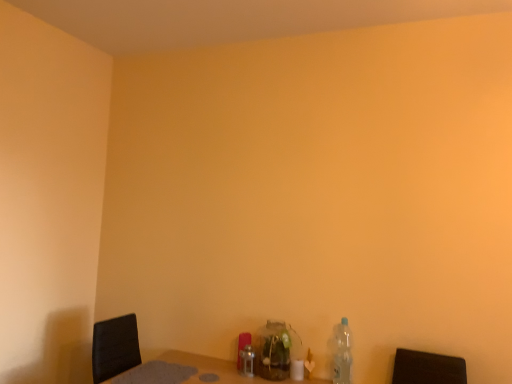
Question: From the image's perspective, is clear plastic bottle at lower right, the first bottle viewed from the right, over brushed metal bottle at center, arranged as the first bottle when viewed from the left?

Choices:
 (A) no
 (B) yes

Answer: (B)

Question: Is clear plastic bottle at lower right, the first bottle viewed from the right, at the right side of brushed metal bottle at center, arranged as the first bottle when viewed from the left?

Choices:
 (A) no
 (B) yes

Answer: (B)

Question: Can we say clear plastic bottle at lower right, marked as the third bottle in a left-to-right arrangement, lies outside brushed metal bottle at center, the third bottle when ordered from right to left?

Choices:
 (A) yes
 (B) no

Answer: (A)

Question: Is the depth of clear plastic bottle at lower right, marked as the third bottle in a left-to-right arrangement, greater than that of brushed metal bottle at center, the third bottle when ordered from right to left?

Choices:
 (A) yes
 (B) no

Answer: (B)

Question: Is clear plastic bottle at lower right, marked as the third bottle in a left-to-right arrangement, positioned with its back to brushed metal bottle at center, the third bottle when ordered from right to left?

Choices:
 (A) yes
 (B) no

Answer: (B)

Question: In terms of width, does brushed metal bottle at center, arranged as the first bottle when viewed from the left, look wider or thinner when compared to translucent glass jar at center, placed as the second bottle when sorted from left to right?

Choices:
 (A) thin
 (B) wide

Answer: (A)

Question: Would you say brushed metal bottle at center, arranged as the first bottle when viewed from the left, is inside or outside translucent glass jar at center, the 2th bottle in the right-to-left sequence?

Choices:
 (A) outside
 (B) inside

Answer: (A)

Question: Relative to translucent glass jar at center, placed as the second bottle when sorted from left to right, is brushed metal bottle at center, the third bottle when ordered from right to left, in front or behind?

Choices:
 (A) behind
 (B) front

Answer: (A)

Question: From a real-world perspective, is brushed metal bottle at center, the third bottle when ordered from right to left, positioned above or below translucent glass jar at center, placed as the second bottle when sorted from left to right?

Choices:
 (A) above
 (B) below

Answer: (B)

Question: Is translucent glass jar at center, placed as the second bottle when sorted from left to right, situated inside brushed metal bottle at center, the third bottle when ordered from right to left, or outside?

Choices:
 (A) inside
 (B) outside

Answer: (B)

Question: Considering the positions of translucent glass jar at center, placed as the second bottle when sorted from left to right, and brushed metal bottle at center, the third bottle when ordered from right to left, in the image, is translucent glass jar at center, placed as the second bottle when sorted from left to right, wider or thinner than brushed metal bottle at center, the third bottle when ordered from right to left,?

Choices:
 (A) wide
 (B) thin

Answer: (A)

Question: Considering the positions of translucent glass jar at center, placed as the second bottle when sorted from left to right, and brushed metal bottle at center, the third bottle when ordered from right to left, in the image, is translucent glass jar at center, placed as the second bottle when sorted from left to right, bigger or smaller than brushed metal bottle at center, the third bottle when ordered from right to left,?

Choices:
 (A) small
 (B) big

Answer: (B)

Question: From their relative heights in the image, would you say translucent glass jar at center, the 2th bottle in the right-to-left sequence, is taller or shorter than brushed metal bottle at center, arranged as the first bottle when viewed from the left?

Choices:
 (A) tall
 (B) short

Answer: (A)

Question: From the image's perspective, relative to clear plastic bottle at lower right, marked as the third bottle in a left-to-right arrangement, is translucent glass jar at center, the 2th bottle in the right-to-left sequence, above or below?

Choices:
 (A) above
 (B) below

Answer: (B)

Question: From a real-world perspective, is translucent glass jar at center, the 2th bottle in the right-to-left sequence, physically located above or below clear plastic bottle at lower right, the first bottle viewed from the right?

Choices:
 (A) above
 (B) below

Answer: (B)